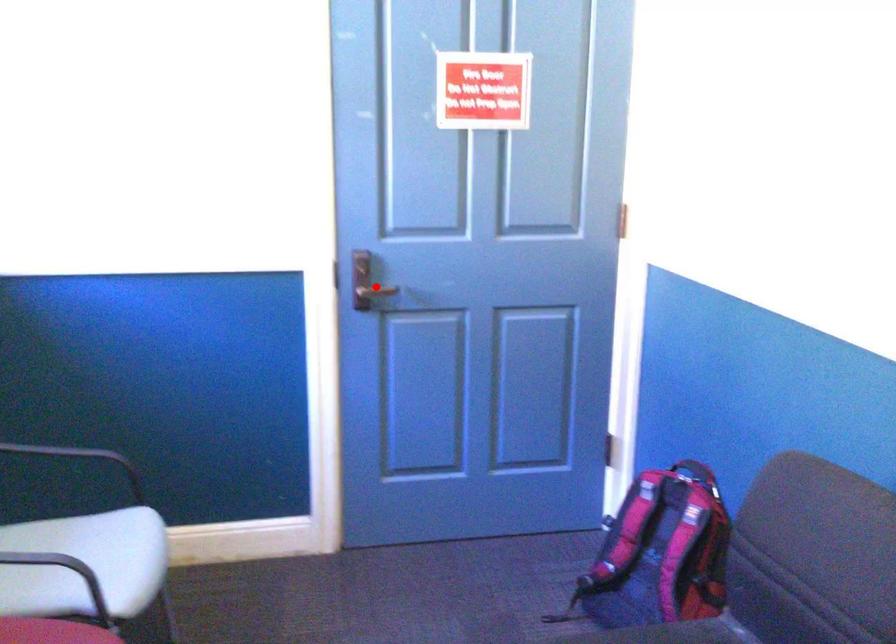
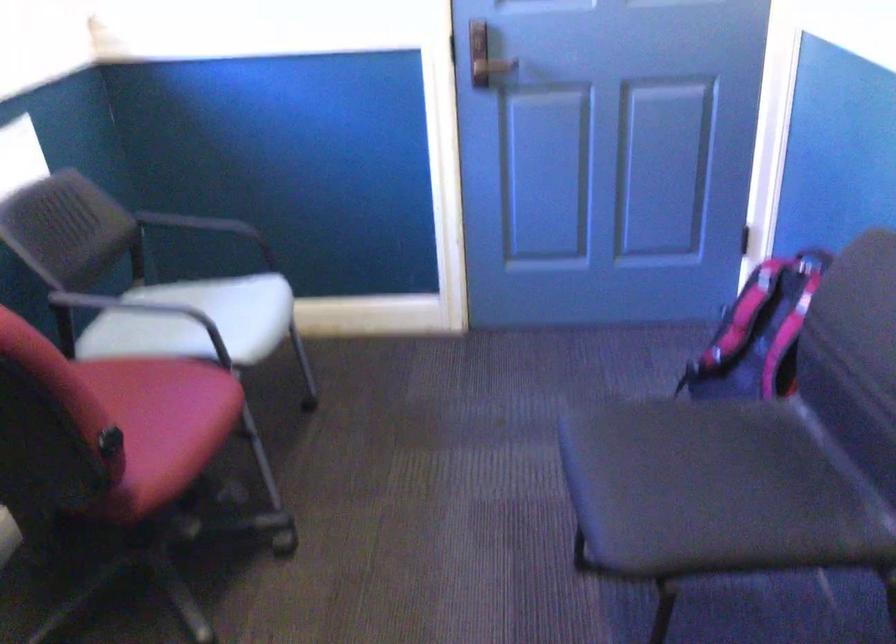
In the second image, find the point that corresponds to the highlighted location in the first image.

(492, 67)